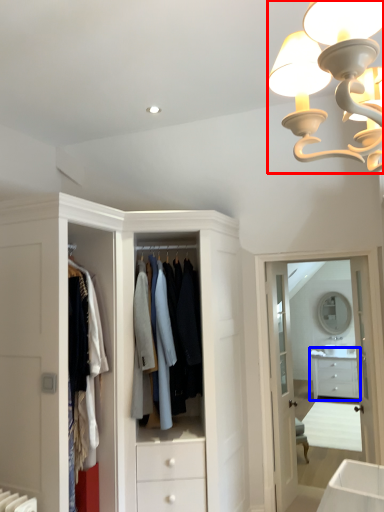
Question: Which of the following is the farthest to the observer, lamp (highlighted by a red box) or chest of drawers (highlighted by a blue box)?

Choices:
 (A) lamp
 (B) chest of drawers

Answer: (B)